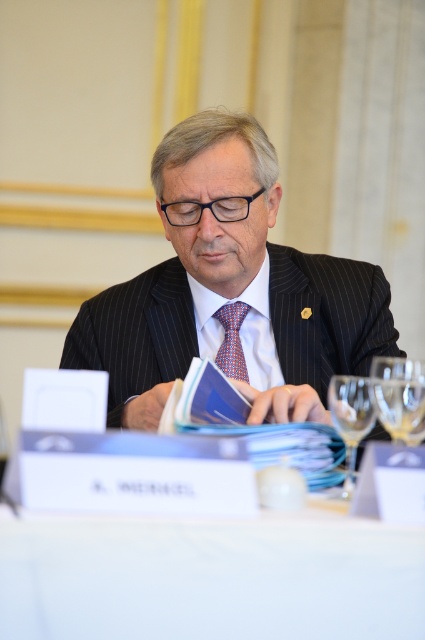
You are an interior designer observing the scene. You need to determine if the pinstriped suit at center can be placed on the white fabric table at center without exceeding its edges. Can it fit?

The pinstriped suit at center is larger in size than white fabric table at center, so it cannot be placed on the table without exceeding its edges.

You are standing in the room where the pinstriped suit at center and transparent glass at lower right are present. Which object is closer to you?

The pinstriped suit at center is closer to you because it is further to the viewer than transparent glass at lower right.